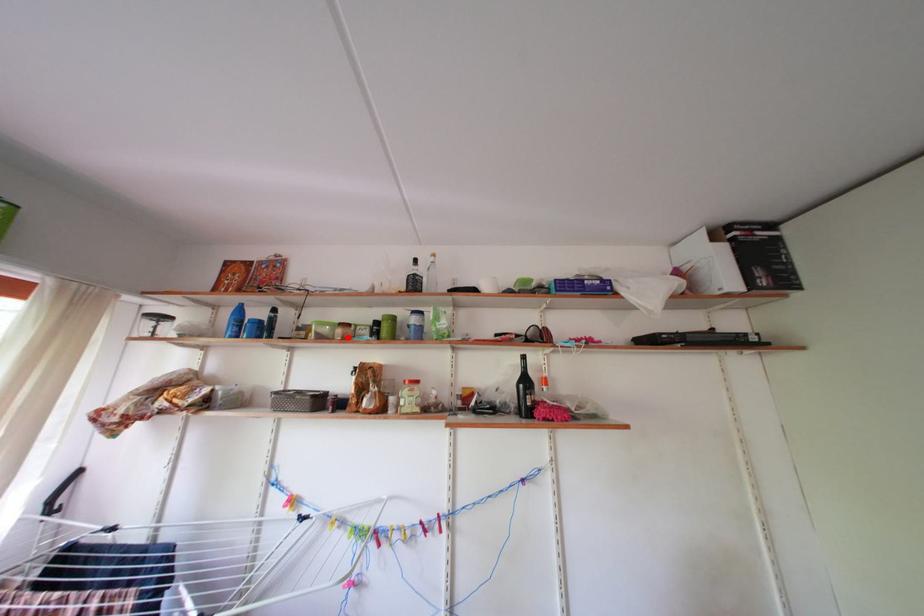
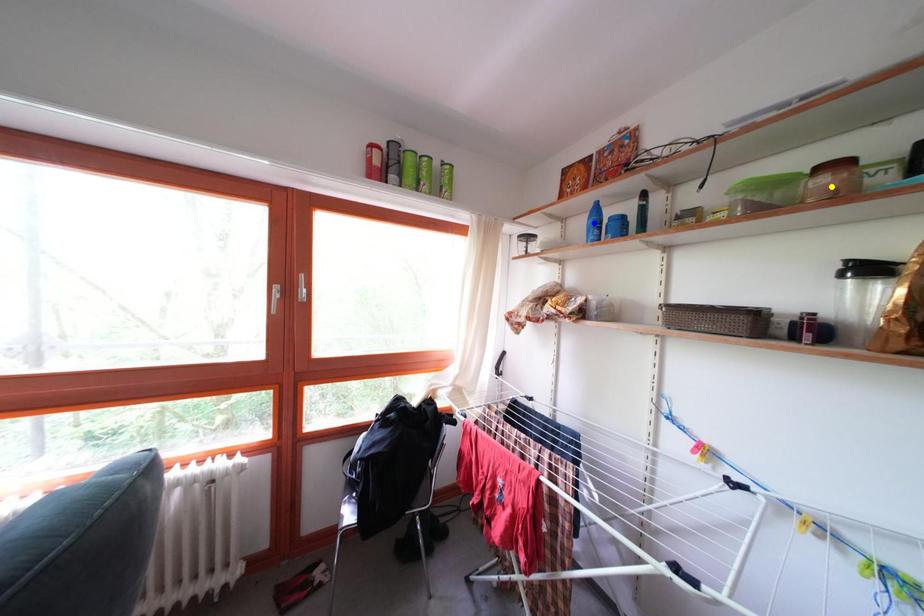
Question: I am providing you with two images of the same scene from different viewpoints. A red point is marked on the first image. You are given multiple points on the second image. Can you choose the point in image 2 that corresponds to the point in image 1?

Choices:
 (A) green point
 (B) yellow point
 (C) blue point

Answer: (B)